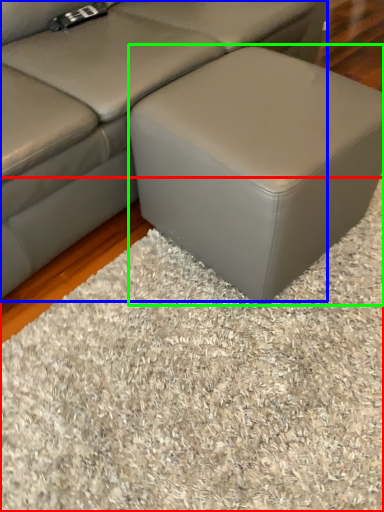
Question: Estimate the real-world distances between objects in this image. Which object is closer to mat (highlighted by a red box), studio couch (highlighted by a blue box) or stool (highlighted by a green box)?

Choices:
 (A) studio couch
 (B) stool

Answer: (B)